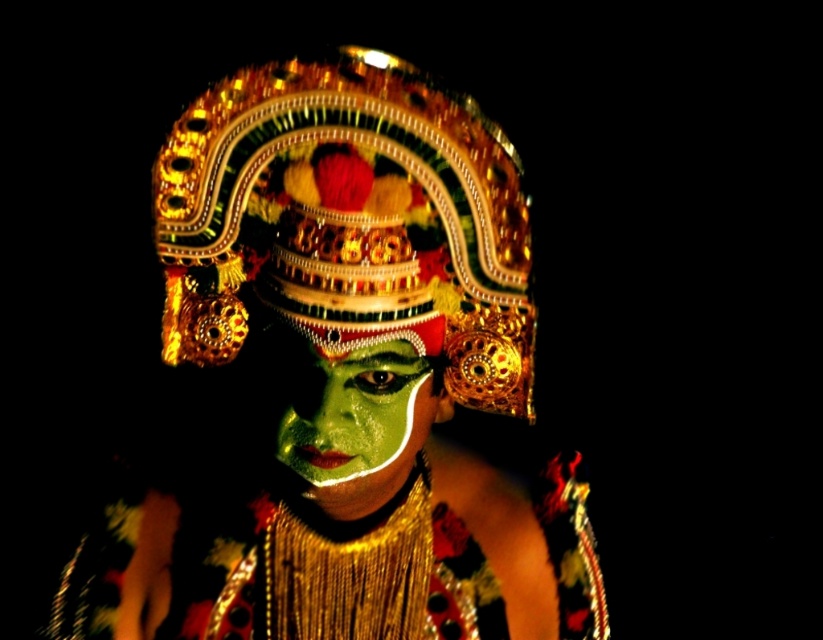
You are observing a traditional dancer in a performance. You notice two points marked on their costume. The first point is at coordinate point(217, 605) and the second point is at coordinate point(398, 378). From your perspective, which point is closer to you?

Point(398, 378) is closer to you because it is in front of point(217, 605) according to the spatial arrangement.

You are an art student analyzing a traditional performance costume. You observe two green matte elements on the performer at the center of the image. Which one is closer to you, the green matte face paint at center or the green matte face at center?

The green matte face paint at center is closer to you because it is in front of the green matte face at center.